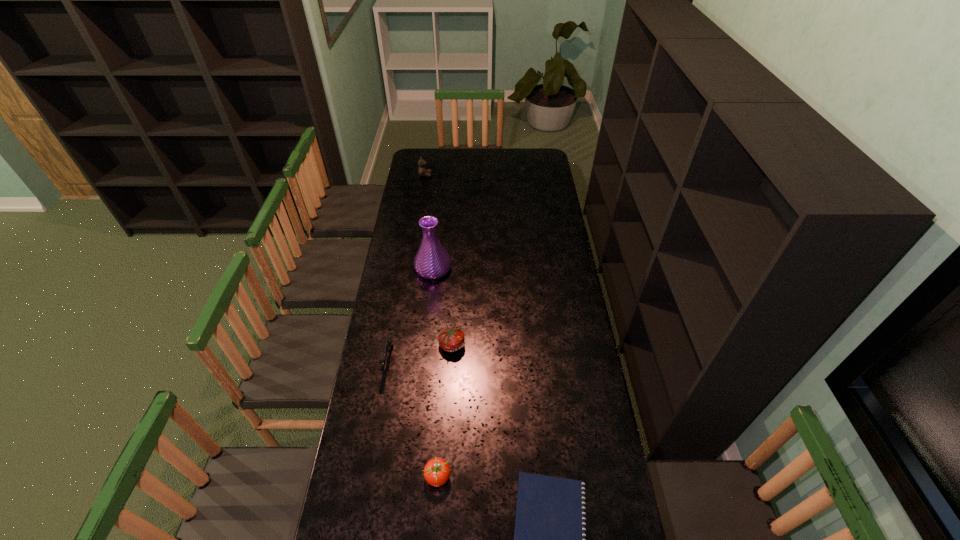
Image resolution: width=960 pixels, height=540 pixels. Identify the location of empty space between the second farthest object and the gun. (411, 315).

Identify the location of vacant space that's between the farthest object and the gun. (407, 268).

Identify the location of unoccupied area between the nearer tomato and the farther tomato. This screenshot has width=960, height=540. (445, 410).

You are a GUI agent. You are given a task and a screenshot of the screen. Output one action in this format:
    pyautogui.click(x=<x>, y=<y>)
    Task: Click on the free spot between the farther tomato and the tallest object
    
    Given the screenshot: What is the action you would take?
    pyautogui.click(x=443, y=307)

You are a GUI agent. You are given a task and a screenshot of the screen. Output one action in this format:
    pyautogui.click(x=<x>, y=<y>)
    Task: Click on the empty space between the farther tomato and the gun
    This screenshot has width=960, height=540.
    Given the screenshot: What is the action you would take?
    pyautogui.click(x=420, y=353)

The height and width of the screenshot is (540, 960). I want to click on the fourth closest object to the vase, so click(437, 471).

Select which object appears as the second closest to the notepad. Please provide its 2D coordinates. Your answer should be formatted as a tuple, i.e. [(x, y)], where the tuple contains the x and y coordinates of a point satisfying the conditions above.

[(451, 339)]

The width and height of the screenshot is (960, 540). Find the location of `vacant area in the image that satisfies the following two spatial constraints: 1. on the back side of the fifth nearest object; 2. on the face of the farthest object`. vacant area in the image that satisfies the following two spatial constraints: 1. on the back side of the fifth nearest object; 2. on the face of the farthest object is located at coordinates (444, 175).

At what (x,y) coordinates should I click in order to perform the action: click on free spot that satisfies the following two spatial constraints: 1. on the face of the teddy bear; 2. at the end of the barrel of the gun. Please return your answer as a coordinate pair (x, y). This screenshot has height=540, width=960. Looking at the image, I should click on (396, 361).

You are a GUI agent. You are given a task and a screenshot of the screen. Output one action in this format:
    pyautogui.click(x=<x>, y=<y>)
    Task: Click on the vacant space that satisfies the following two spatial constraints: 1. on the front side of the farther tomato; 2. on the left side of the tallest object
    This screenshot has height=540, width=960.
    Given the screenshot: What is the action you would take?
    pyautogui.click(x=425, y=345)